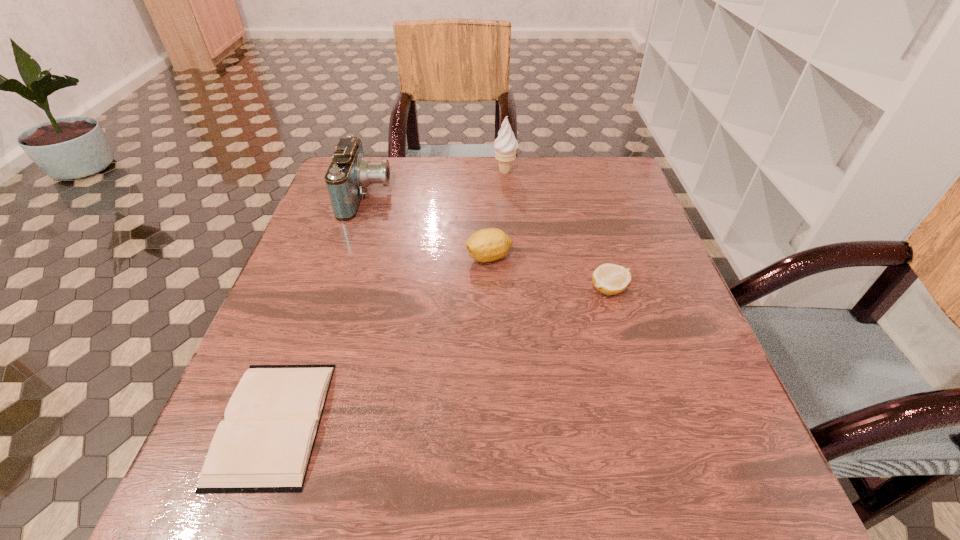
This screenshot has height=540, width=960. Identify the location of icecream. (505, 145).

I want to click on the fourth shortest object, so click(349, 174).

In order to click on the taller lemon in this screenshot , I will do `click(486, 245)`.

The height and width of the screenshot is (540, 960). In order to click on the farther lemon in this screenshot , I will do `click(486, 245)`.

Identify the location of the rightmost object. The height and width of the screenshot is (540, 960). (610, 279).

The height and width of the screenshot is (540, 960). In order to click on the right lemon in this screenshot , I will do `click(610, 279)`.

Identify the location of the nearest object. The image size is (960, 540). (264, 445).

Locate an element on the screen. This screenshot has height=540, width=960. hardback book is located at coordinates (x=264, y=445).

Identify the location of free space located 0.260m on the front-facing side of the tallest object. (510, 237).

Image resolution: width=960 pixels, height=540 pixels. In order to click on vacant space located on the front-facing side of the second tallest object in this screenshot , I will do `click(460, 197)`.